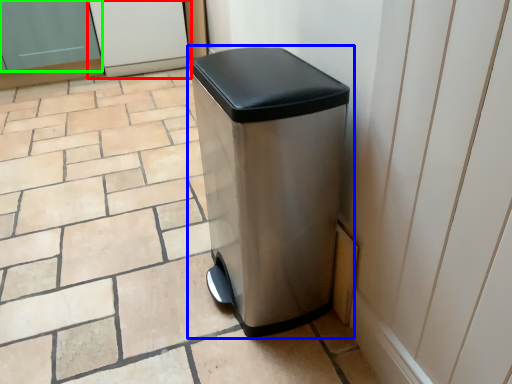
Question: Estimate the real-world distances between objects in this image. Which object is closer to screen door (highlighted by a red box), waste container (highlighted by a blue box) or screen door (highlighted by a green box)?

Choices:
 (A) waste container
 (B) screen door

Answer: (B)